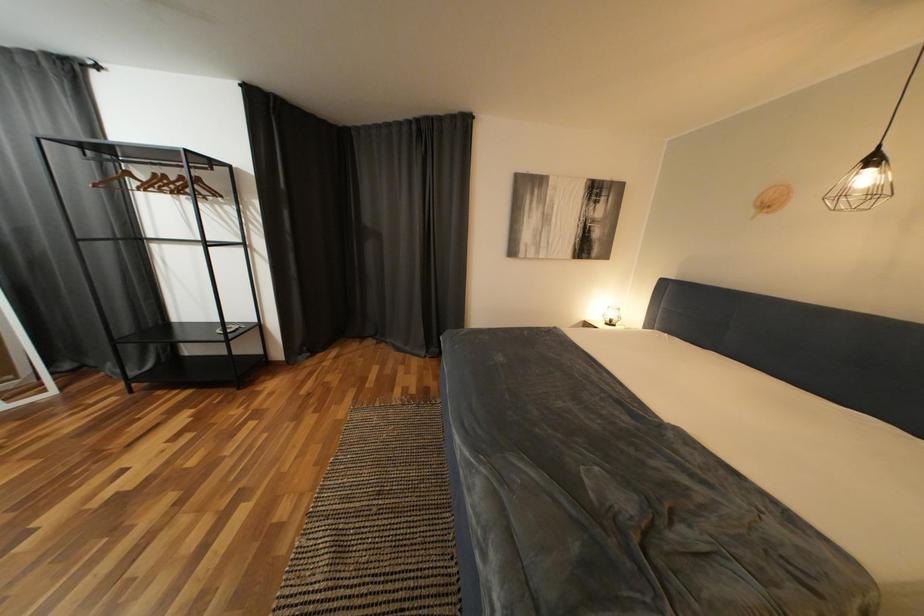
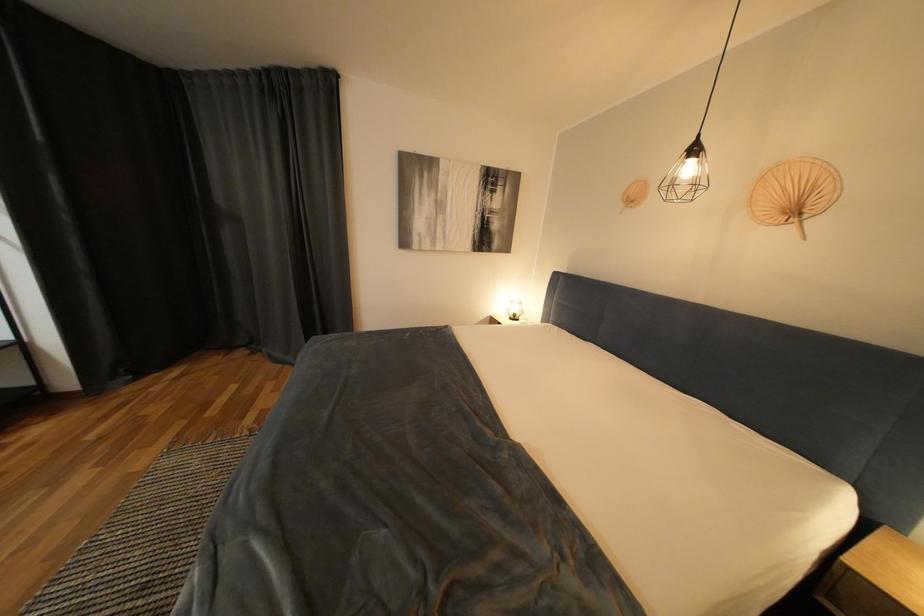
Question: The images are taken continuously from a first-person perspective. In which direction is your viewpoint rotating?

Choices:
 (A) Left
 (B) Right
 (C) Up
 (D) Down

Answer: (B)